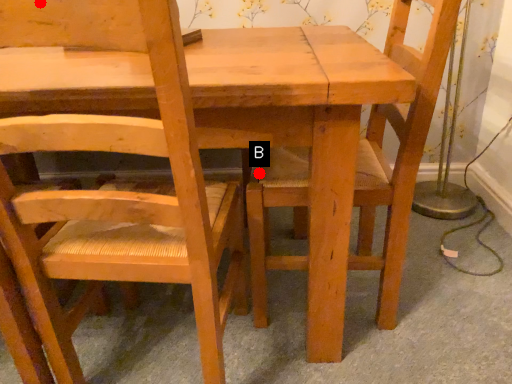
Question: Two points are circled on the image, labeled by A and B beside each circle. Which point is closer to the camera taking this photo?

Choices:
 (A) A is closer
 (B) B is closer

Answer: (A)